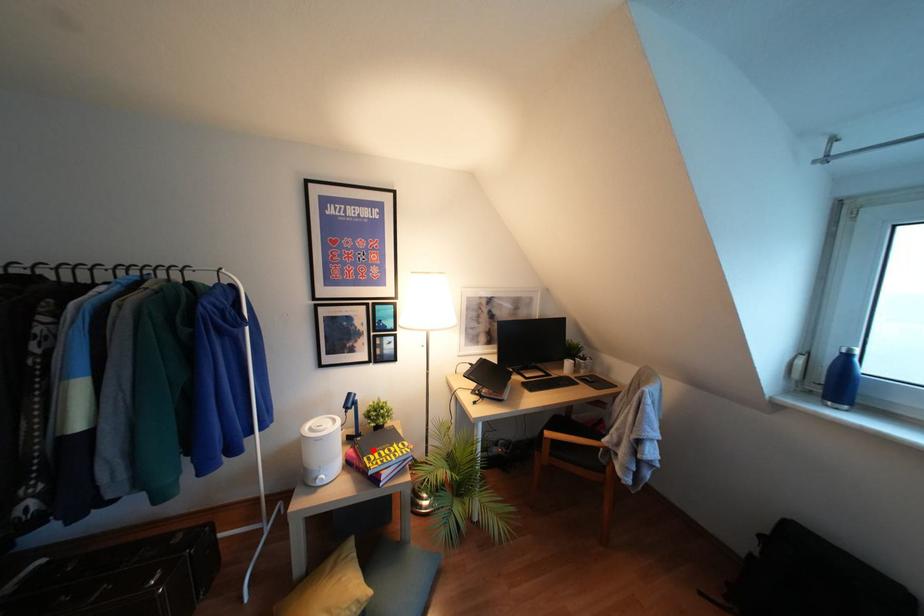
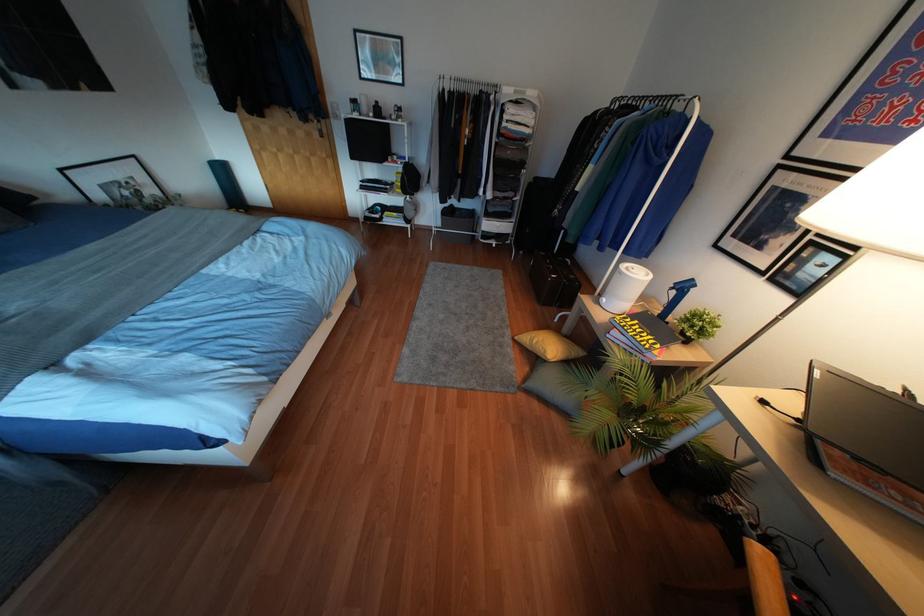
Where in the second image is the point corresponding to the highlighted location from the first image?

(637, 321)